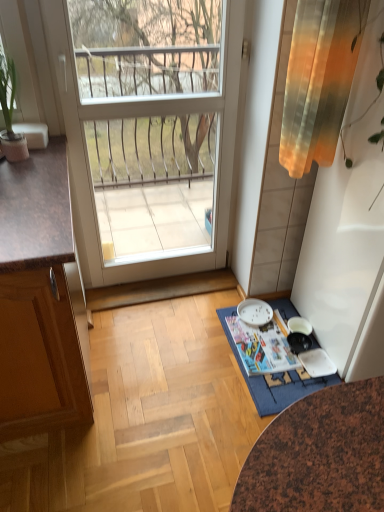
Question: Does white glossy door at center appear on the right side of gradient fabric curtain at upper right?

Choices:
 (A) yes
 (B) no

Answer: (B)

Question: Is white glossy door at center smaller than gradient fabric curtain at upper right?

Choices:
 (A) yes
 (B) no

Answer: (B)

Question: Does white glossy door at center have a greater width compared to gradient fabric curtain at upper right?

Choices:
 (A) no
 (B) yes

Answer: (A)

Question: From the image's perspective, is white glossy door at center over gradient fabric curtain at upper right?

Choices:
 (A) no
 (B) yes

Answer: (A)

Question: Does white glossy door at center have a greater height compared to gradient fabric curtain at upper right?

Choices:
 (A) yes
 (B) no

Answer: (A)

Question: Do you think blue fabric doormat at lower center is within green leafy plant in pot at left, or outside of it?

Choices:
 (A) inside
 (B) outside

Answer: (B)

Question: Does point (319, 382) appear closer or farther from the camera than point (6, 113)?

Choices:
 (A) closer
 (B) farther

Answer: (B)

Question: In terms of size, does blue fabric doormat at lower center appear bigger or smaller than green leafy plant in pot at left?

Choices:
 (A) small
 (B) big

Answer: (A)

Question: Is blue fabric doormat at lower center to the left or to the right of green leafy plant in pot at left in the image?

Choices:
 (A) left
 (B) right

Answer: (B)

Question: Is blue fabric doormat at lower center inside or outside of white glossy plate at lower center?

Choices:
 (A) inside
 (B) outside

Answer: (B)

Question: From a real-world perspective, relative to white glossy plate at lower center, is blue fabric doormat at lower center vertically above or below?

Choices:
 (A) above
 (B) below

Answer: (B)

Question: From the image's perspective, is blue fabric doormat at lower center located above or below white glossy plate at lower center?

Choices:
 (A) below
 (B) above

Answer: (A)

Question: Based on their sizes in the image, would you say blue fabric doormat at lower center is bigger or smaller than white glossy plate at lower center?

Choices:
 (A) big
 (B) small

Answer: (A)

Question: In terms of size, does white glossy plate at lower center appear bigger or smaller than gradient fabric curtain at upper right?

Choices:
 (A) big
 (B) small

Answer: (B)

Question: From the image's perspective, relative to gradient fabric curtain at upper right, is white glossy plate at lower center above or below?

Choices:
 (A) above
 (B) below

Answer: (B)